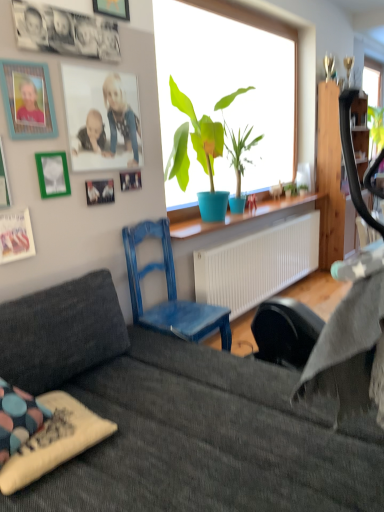
Image resolution: width=384 pixels, height=512 pixels. What do you see at coordinates (112, 8) in the screenshot?
I see `wooden picture frame at upper left, the 1th picture frame in the top-to-bottom sequence` at bounding box center [112, 8].

In order to face wooden picture frame at upper left, the 1th picture frame in the top-to-bottom sequence, should I rotate leftwards or rightwards?

You should look left and rotate roughly 10.972 degrees.

At what (x,y) coordinates should I click in order to perform the action: click on polka dot fabric pillow at lower left. Please return your answer as a coordinate pair (x, y). The image size is (384, 512). Looking at the image, I should click on (54, 441).

Describe the element at coordinates (332, 181) in the screenshot. The image size is (384, 512). I see `wooden cabinet at right` at that location.

The height and width of the screenshot is (512, 384). What are the coordinates of `dark gray fabric couch at lower center` in the screenshot? It's located at pos(179,418).

Image resolution: width=384 pixels, height=512 pixels. Describe the element at coordinates (179, 418) in the screenshot. I see `dark gray fabric couch at lower center` at that location.

Image resolution: width=384 pixels, height=512 pixels. In order to click on metallic silver picture frame at left, which ranks as the 8th picture frame in top-to-bottom order in this screenshot , I will do `click(16, 234)`.

This screenshot has height=512, width=384. What do you see at coordinates (193, 141) in the screenshot?
I see `matte blue pot at window` at bounding box center [193, 141].

Image resolution: width=384 pixels, height=512 pixels. What are the coordinates of `wooden picture frame at upper left, the 1th picture frame in the top-to-bottom sequence` in the screenshot? It's located at (112, 8).

The height and width of the screenshot is (512, 384). There is a matte plastic picture frame at upper left, acting as the second picture frame starting from the top. What are the coordinates of `the 5th picture frame below it (from a real-world perspective)` in the screenshot? It's located at (16, 234).

Is matte plastic picture frame at upper left, which is the seventh picture frame from bottom to top, positioned beyond the bounds of metallic silver picture frame at left, which is the first picture frame in bottom-to-top order?

Absolutely, matte plastic picture frame at upper left, which is the seventh picture frame from bottom to top, is external to metallic silver picture frame at left, which is the first picture frame in bottom-to-top order.

Considering the relative sizes of matte plastic picture frame at upper left, which is the seventh picture frame from bottom to top, and metallic silver picture frame at left, which ranks as the 8th picture frame in top-to-bottom order, in the image provided, is matte plastic picture frame at upper left, which is the seventh picture frame from bottom to top, smaller than metallic silver picture frame at left, which ranks as the 8th picture frame in top-to-bottom order,?

No.

How many degrees apart are the facing directions of matte plastic picture frame at upper left, acting as the second picture frame starting from the top, and metallic silver picture frame at left, which ranks as the 8th picture frame in top-to-bottom order?

The facing directions of matte plastic picture frame at upper left, acting as the second picture frame starting from the top, and metallic silver picture frame at left, which ranks as the 8th picture frame in top-to-bottom order, are 0.0787 degrees apart.

Could you tell me if matte blue pot at window is turned towards wooden cabinet at right?

No, matte blue pot at window is not oriented towards wooden cabinet at right.

There is a wooden cabinet at right. Where is `houseplant above it (from a real-world perspective)`? Image resolution: width=384 pixels, height=512 pixels. houseplant above it (from a real-world perspective) is located at coordinates (193, 141).

Is matte blue pot at window smaller than wooden cabinet at right?

Yes, matte blue pot at window is smaller than wooden cabinet at right.

From the image's perspective, is matte blue pot at window above wooden cabinet at right?

Incorrect, from the image's perspective, matte blue pot at window is lower than wooden cabinet at right.

How distant is wooden picture frame at upper left, placed as the 4th picture frame when sorted from top to bottom, from matte plastic picture frame at upper left, which is the seventh picture frame from bottom to top?

They are 12.11 inches apart.

From the image's perspective, is wooden picture frame at upper left, which ranks as the fifth picture frame in bottom-to-top order, below matte plastic picture frame at upper left, which is the seventh picture frame from bottom to top?

Yes, from the image's perspective, wooden picture frame at upper left, which ranks as the fifth picture frame in bottom-to-top order, is beneath matte plastic picture frame at upper left, which is the seventh picture frame from bottom to top.

Considering the positions of points (132, 178) and (114, 162), is point (132, 178) closer to camera compared to point (114, 162)?

No, (132, 178) is behind (114, 162).

Is wooden picture frame at upper left, which ranks as the fifth picture frame in bottom-to-top order, in front of or behind matte plastic picture frame at upper left, which is the seventh picture frame from bottom to top, in the image?

Visually, wooden picture frame at upper left, which ranks as the fifth picture frame in bottom-to-top order, is located behind matte plastic picture frame at upper left, which is the seventh picture frame from bottom to top.

Between polka dot fabric pillow at lower left and green matte picture frame at upper left, the 7th picture frame when ordered from top to bottom, which one has less height?

With less height is polka dot fabric pillow at lower left.

Is polka dot fabric pillow at lower left positioned behind green matte picture frame at upper left, which is the 2th picture frame from bottom to top?

No, polka dot fabric pillow at lower left is closer to the viewer.

From the image's perspective, is polka dot fabric pillow at lower left above green matte picture frame at upper left, the 7th picture frame when ordered from top to bottom?

No, from the image's perspective, polka dot fabric pillow at lower left is not over green matte picture frame at upper left, the 7th picture frame when ordered from top to bottom.

Is polka dot fabric pillow at lower left turned away from green matte picture frame at upper left, which is the 2th picture frame from bottom to top?

No, polka dot fabric pillow at lower left is not facing the opposite direction of green matte picture frame at upper left, which is the 2th picture frame from bottom to top.

Can you confirm if wooden cabinet at right is thinner than matte blue pot at window?

Indeed, wooden cabinet at right has a lesser width compared to matte blue pot at window.

From the image's perspective, between wooden cabinet at right and matte blue pot at window, which one is located above?

wooden cabinet at right, from the image's perspective.

Can you confirm if wooden cabinet at right is smaller than matte blue pot at window?

No, wooden cabinet at right is not smaller than matte blue pot at window.

From a real-world perspective, relative to matte blue pot at window, is wooden cabinet at right vertically above or below?

wooden cabinet at right is below matte blue pot at window.

Is point (7, 260) closer or farther from the camera than point (335, 252)?

Point (7, 260) appears to be closer to the viewer than point (335, 252).

Is metallic silver picture frame at left, which ranks as the 8th picture frame in top-to-bottom order, not near wooden cabinet at right?

Yes.

Measure the distance between metallic silver picture frame at left, which ranks as the 8th picture frame in top-to-bottom order, and wooden cabinet at right.

A distance of 3.25 meters exists between metallic silver picture frame at left, which ranks as the 8th picture frame in top-to-bottom order, and wooden cabinet at right.

Which of these two, metallic silver picture frame at left, which is the first picture frame in bottom-to-top order, or wooden cabinet at right, is wider?

Wider between the two is wooden cabinet at right.

From a real-world perspective, is matte blue pot at window below wooden picture frame at upper left, placed as the 4th picture frame when sorted from top to bottom?

No, from a real-world perspective, matte blue pot at window is not below wooden picture frame at upper left, placed as the 4th picture frame when sorted from top to bottom.

Which is behind, point (186, 135) or point (122, 187)?

The point (186, 135) is more distant.

Can you confirm if matte blue pot at window is taller than wooden picture frame at upper left, placed as the 4th picture frame when sorted from top to bottom?

Indeed, matte blue pot at window has a greater height compared to wooden picture frame at upper left, placed as the 4th picture frame when sorted from top to bottom.

From the image's perspective, count 6th picture frames downward from the matte plastic picture frame at upper left, which is the seventh picture frame from bottom to top, and point to it. Please provide its 2D coordinates.

[(16, 234)]

Where is `cabinetry on the right side of matte blue pot at window`? cabinetry on the right side of matte blue pot at window is located at coordinates (332, 181).

Based on their spatial positions, is dark gray fabric couch at lower center or metallic silver picture frame at left, which is the first picture frame in bottom-to-top order, further from wooden picture frame at upper left, which ranks as the fifth picture frame in bottom-to-top order?

dark gray fabric couch at lower center is positioned further to the anchor wooden picture frame at upper left, which ranks as the fifth picture frame in bottom-to-top order.

Based on their spatial positions, is teal wooden picture frame at upper left, positioned as the 3th picture frame in top-to-bottom order, or polka dot fabric pillow at lower left further from dark gray fabric couch at lower center?

teal wooden picture frame at upper left, positioned as the 3th picture frame in top-to-bottom order, lies further to dark gray fabric couch at lower center than the other object.

Looking at the image, which one is located further to wooden cabinet at right, metallic silver photo frame at upper left, the 3th picture frame in the bottom-to-top sequence, or polka dot fabric pillow at lower left?

polka dot fabric pillow at lower left lies further to wooden cabinet at right than the other object.

From the picture: When comparing their distances from matte plastic picture frame at upper left, acting as the second picture frame starting from the top, does wooden cabinet at right or wooden picture frame at upper left, placed as the 4th picture frame when sorted from top to bottom, seem closer?

wooden picture frame at upper left, placed as the 4th picture frame when sorted from top to bottom.

From the image, which object appears to be nearer to green matte picture frame at upper left, the 7th picture frame when ordered from top to bottom, dark gray fabric couch at lower center or metallic silver photo frame at upper left, the 3th picture frame in the bottom-to-top sequence?

Based on the image, metallic silver photo frame at upper left, the 3th picture frame in the bottom-to-top sequence, appears to be nearer to green matte picture frame at upper left, the 7th picture frame when ordered from top to bottom.

Looking at the image, which one is located further to green matte picture frame at upper left, the 7th picture frame when ordered from top to bottom, wooden picture frame at upper left, the 1th picture frame in the top-to-bottom sequence, or polka dot fabric pillow at lower left?

polka dot fabric pillow at lower left is positioned further to the anchor green matte picture frame at upper left, the 7th picture frame when ordered from top to bottom.

Estimate the real-world distances between objects in this image. Which object is closer to wooden picture frame at upper left, the 8th picture frame in the bottom-to-top sequence, metallic silver photo frame at upper left, the 3th picture frame in the bottom-to-top sequence, or matte blue pot at window?

metallic silver photo frame at upper left, the 3th picture frame in the bottom-to-top sequence.

Looking at the image, which one is located further to metallic silver picture frame at left, which ranks as the 8th picture frame in top-to-bottom order, matte plastic picture frame at upper left, acting as the second picture frame starting from the top, or wooden picture frame at upper left, the 1th picture frame in the top-to-bottom sequence?

Among the two, wooden picture frame at upper left, the 1th picture frame in the top-to-bottom sequence, is located further to metallic silver picture frame at left, which ranks as the 8th picture frame in top-to-bottom order.

Locate an element on the screen. houseplant situated between metallic silver picture frame at left, which ranks as the 8th picture frame in top-to-bottom order, and wooden cabinet at right from left to right is located at coordinates (193, 141).

Where is `chair between wooden picture frame at upper left, the 1th picture frame in the top-to-bottom sequence, and wooden cabinet at right in the front-back direction`? The image size is (384, 512). chair between wooden picture frame at upper left, the 1th picture frame in the top-to-bottom sequence, and wooden cabinet at right in the front-back direction is located at coordinates (169, 293).

Locate an element on the screen. The width and height of the screenshot is (384, 512). chair located between dark gray fabric couch at lower center and wooden cabinet at right in the depth direction is located at coordinates (169, 293).

You are a GUI agent. You are given a task and a screenshot of the screen. Output one action in this format:
    pyautogui.click(x=<x>, y=<y>)
    Task: Click on the picture frame between green matte picture frame at upper left, the 7th picture frame when ordered from top to bottom, and polka dot fabric pillow at lower left, in the vertical direction
    
    Given the screenshot: What is the action you would take?
    pyautogui.click(x=16, y=234)